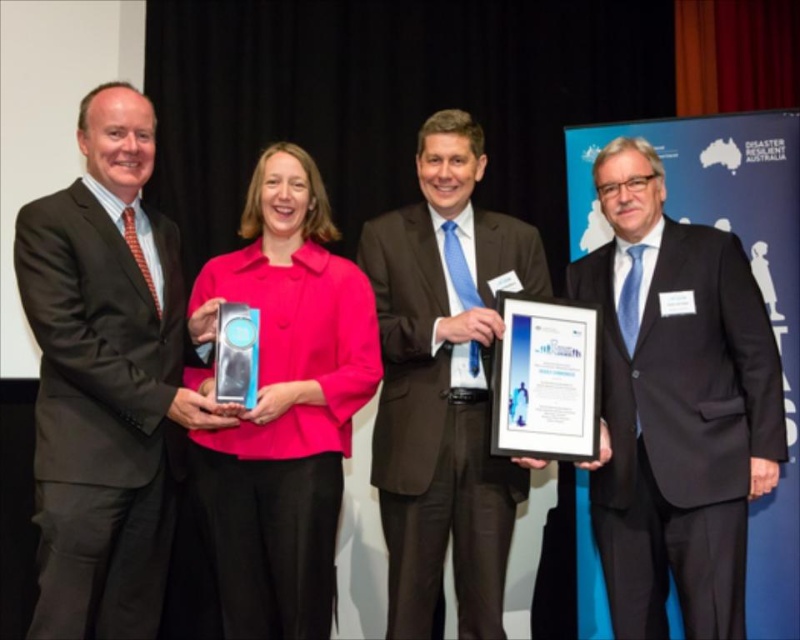
Question: Which point is closer to the camera taking this photo?

Choices:
 (A) pos(484,474)
 (B) pos(645,182)
 (C) pos(90,243)
 (D) pos(274,259)

Answer: (C)

Question: Which object appears farthest from the camera in this image?

Choices:
 (A) black suit at center
 (B) matte black suit at left
 (C) matte pink jacket at center
 (D) matte black suit at center

Answer: (D)

Question: Where is matte black suit at left located in relation to matte pink jacket at center in the image?

Choices:
 (A) right
 (B) left

Answer: (B)

Question: Is matte black suit at left below matte black suit at center?

Choices:
 (A) yes
 (B) no

Answer: (B)

Question: Which point is closer to the camera?

Choices:
 (A) black suit at center
 (B) matte black suit at center
 (C) matte pink jacket at center

Answer: (C)

Question: Does black suit at center have a larger size compared to matte pink jacket at center?

Choices:
 (A) no
 (B) yes

Answer: (B)